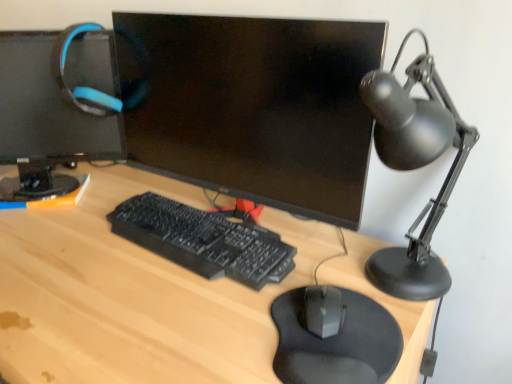
This screenshot has width=512, height=384. What are the coordinates of `vacant area that is in front of matte black monitor at upper left, placed as the 1th computer monitor when sorted from left to right` in the screenshot? It's located at (51, 232).